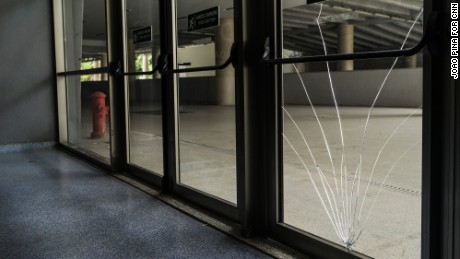
Locate an element on the screen. door handle is located at coordinates 377,54, 199,65, 138,71, 85,70.